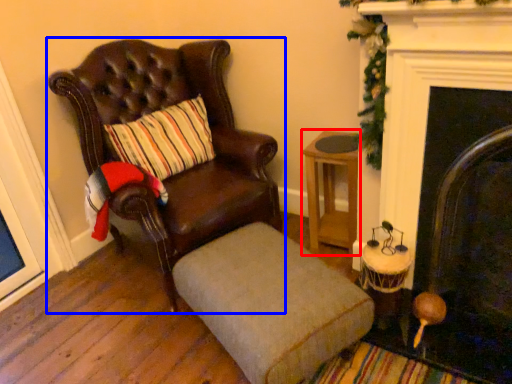
Question: Among these objects, which one is nearest to the camera, table (highlighted by a red box) or chair (highlighted by a blue box)?

Choices:
 (A) table
 (B) chair

Answer: (B)